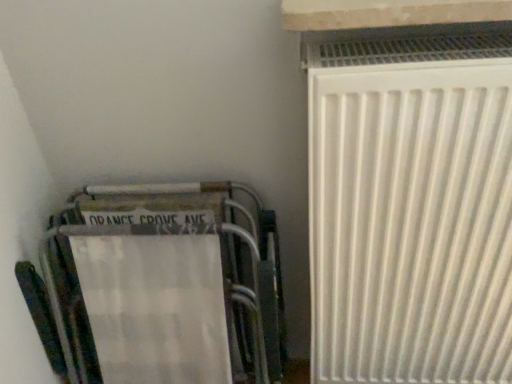
Question: Can you confirm if white stone window sill at upper right is shorter than white matte radiator at right?

Choices:
 (A) no
 (B) yes

Answer: (B)

Question: Is white stone window sill at upper right touching white matte radiator at right?

Choices:
 (A) no
 (B) yes

Answer: (A)

Question: Is white stone window sill at upper right taller than white matte radiator at right?

Choices:
 (A) yes
 (B) no

Answer: (B)

Question: From the image's perspective, is white stone window sill at upper right below white matte radiator at right?

Choices:
 (A) yes
 (B) no

Answer: (B)

Question: Considering the relative sizes of white stone window sill at upper right and white matte radiator at right in the image provided, is white stone window sill at upper right smaller than white matte radiator at right?

Choices:
 (A) no
 (B) yes

Answer: (B)

Question: From the image's perspective, is white stone window sill at upper right located above white matte radiator at right?

Choices:
 (A) no
 (B) yes

Answer: (B)

Question: Is metallic silver folding chair at lower left facing towards white matte radiator at right?

Choices:
 (A) yes
 (B) no

Answer: (B)

Question: Does metallic silver folding chair at lower left have a greater width compared to white matte radiator at right?

Choices:
 (A) no
 (B) yes

Answer: (A)

Question: Is metallic silver folding chair at lower left behind white matte radiator at right?

Choices:
 (A) no
 (B) yes

Answer: (B)

Question: From the image's perspective, is metallic silver folding chair at lower left over white matte radiator at right?

Choices:
 (A) no
 (B) yes

Answer: (A)

Question: Is metallic silver folding chair at lower left taller than white matte radiator at right?

Choices:
 (A) no
 (B) yes

Answer: (A)

Question: Can you confirm if metallic silver folding chair at lower left is smaller than white matte radiator at right?

Choices:
 (A) no
 (B) yes

Answer: (B)

Question: Does metallic silver folding chair at lower left have a greater height compared to white stone window sill at upper right?

Choices:
 (A) no
 (B) yes

Answer: (B)